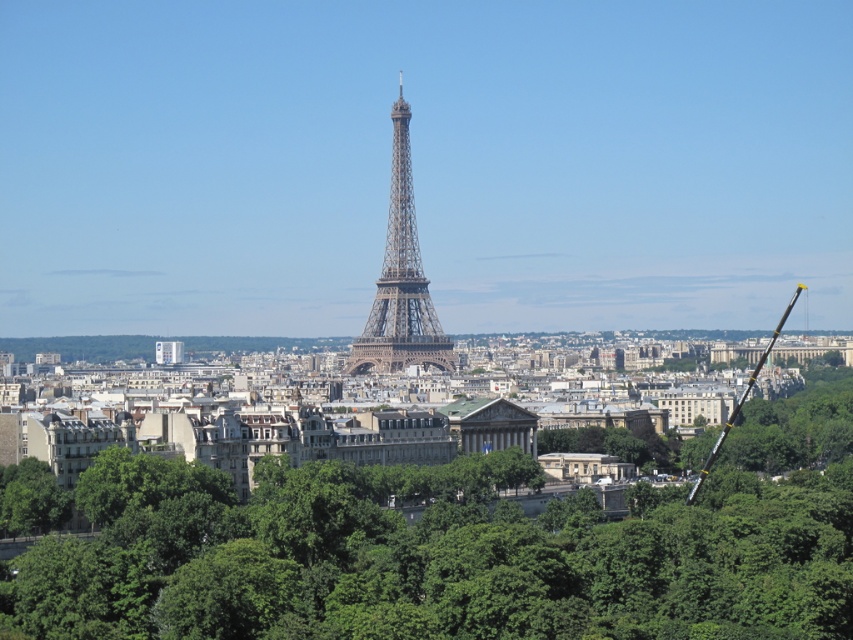
Question: Which object appears farthest from the camera in this image?

Choices:
 (A) metallic lattice tower at center
 (B) green leafy tree at center

Answer: (A)

Question: Among these points, which one is farthest from the camera?

Choices:
 (A) (392, 346)
 (B) (115, 609)

Answer: (A)

Question: Which of the following is the closest to the observer?

Choices:
 (A) green leafy tree at center
 (B) metallic lattice tower at center

Answer: (A)

Question: Can you confirm if green leafy tree at center is bigger than metallic lattice tower at center?

Choices:
 (A) yes
 (B) no

Answer: (A)

Question: Can you confirm if green leafy tree at center is positioned to the right of metallic lattice tower at center?

Choices:
 (A) yes
 (B) no

Answer: (A)

Question: Can you confirm if green leafy tree at center is positioned below metallic lattice tower at center?

Choices:
 (A) no
 (B) yes

Answer: (B)